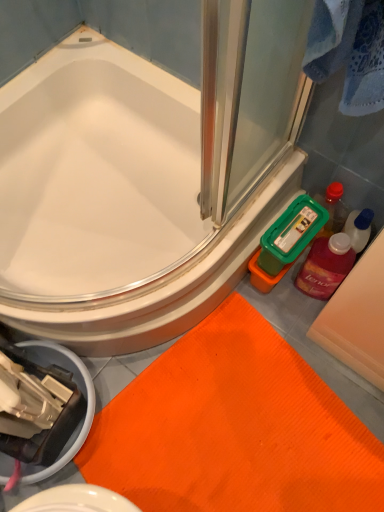
Question: Considering the relative positions of translucent plastic mouthwash at right and white glossy bathtub at upper left in the image provided, is translucent plastic mouthwash at right to the left of white glossy bathtub at upper left from the viewer's perspective?

Choices:
 (A) no
 (B) yes

Answer: (A)

Question: Is translucent plastic mouthwash at right wider than white glossy bathtub at upper left?

Choices:
 (A) yes
 (B) no

Answer: (B)

Question: Is translucent plastic mouthwash at right with white glossy bathtub at upper left?

Choices:
 (A) yes
 (B) no

Answer: (B)

Question: Does translucent plastic mouthwash at right come behind white glossy bathtub at upper left?

Choices:
 (A) no
 (B) yes

Answer: (B)

Question: Is there a large distance between translucent plastic mouthwash at right and white glossy bathtub at upper left?

Choices:
 (A) no
 (B) yes

Answer: (A)

Question: Can you confirm if translucent plastic mouthwash at right is bigger than white glossy bathtub at upper left?

Choices:
 (A) no
 (B) yes

Answer: (A)

Question: From a real-world perspective, is white glossy bathtub at upper left physically below translucent plastic mouthwash at right?

Choices:
 (A) yes
 (B) no

Answer: (B)

Question: Does white glossy bathtub at upper left turn towards translucent plastic mouthwash at right?

Choices:
 (A) no
 (B) yes

Answer: (B)

Question: Is translucent plastic mouthwash at right at the back of white glossy bathtub at upper left?

Choices:
 (A) no
 (B) yes

Answer: (A)

Question: Is white glossy bathtub at upper left at the left side of translucent plastic mouthwash at right?

Choices:
 (A) yes
 (B) no

Answer: (A)

Question: Is white glossy bathtub at upper left shorter than translucent plastic mouthwash at right?

Choices:
 (A) yes
 (B) no

Answer: (A)

Question: From the image's perspective, does white glossy bathtub at upper left appear higher than translucent plastic mouthwash at right?

Choices:
 (A) no
 (B) yes

Answer: (B)

Question: Is translucent plastic mouthwash at right placed right next to orange textured bath mat at lower center?

Choices:
 (A) yes
 (B) no

Answer: (B)